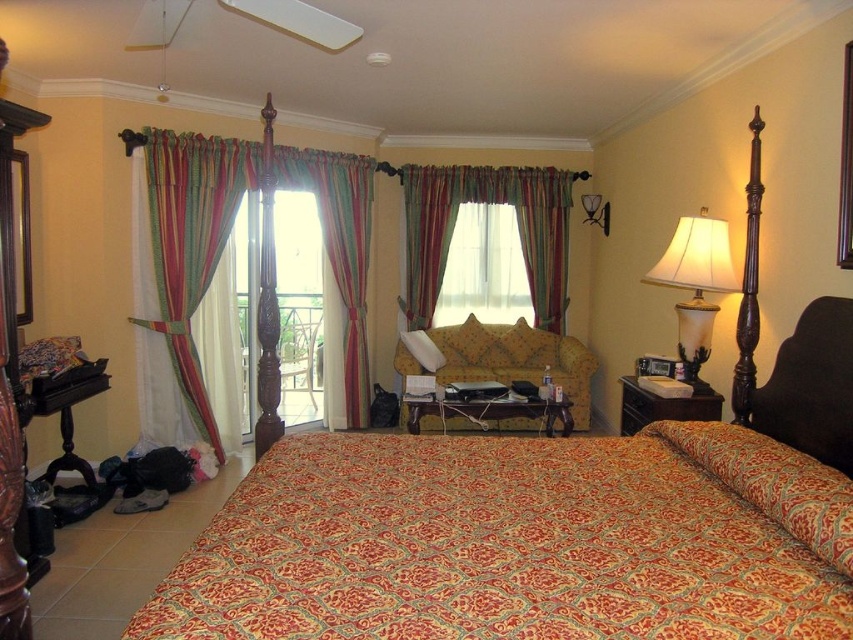
Can you confirm if striped fabric curtains at center is bigger than white glossy lampshade at upper right?

Correct, striped fabric curtains at center is larger in size than white glossy lampshade at upper right.

You are a GUI agent. You are given a task and a screenshot of the screen. Output one action in this format:
    pyautogui.click(x=<x>, y=<y>)
    Task: Click on the striped fabric curtains at center
    
    Given the screenshot: What is the action you would take?
    pyautogui.click(x=229, y=234)

Is yellow floral fabric sofa at center bigger than white glossy lampshade at upper right?

Indeed, yellow floral fabric sofa at center has a larger size compared to white glossy lampshade at upper right.

Is yellow floral fabric sofa at center closer to camera compared to white glossy lampshade at upper right?

Yes, it is in front of white glossy lampshade at upper right.

The height and width of the screenshot is (640, 853). Describe the element at coordinates (515, 358) in the screenshot. I see `yellow floral fabric sofa at center` at that location.

Identify the location of yellow floral fabric sofa at center. (515, 358).

Who is taller, transparent glass door at center or translucent glass lampshade at right?

With more height is transparent glass door at center.

Which is behind, point (292, 280) or point (699, 353)?

The point (292, 280) is behind.

Is point (244, 394) farther from camera compared to point (708, 332)?

Yes, point (244, 394) is behind point (708, 332).

Locate an element on the screen. The image size is (853, 640). transparent glass door at center is located at coordinates (299, 305).